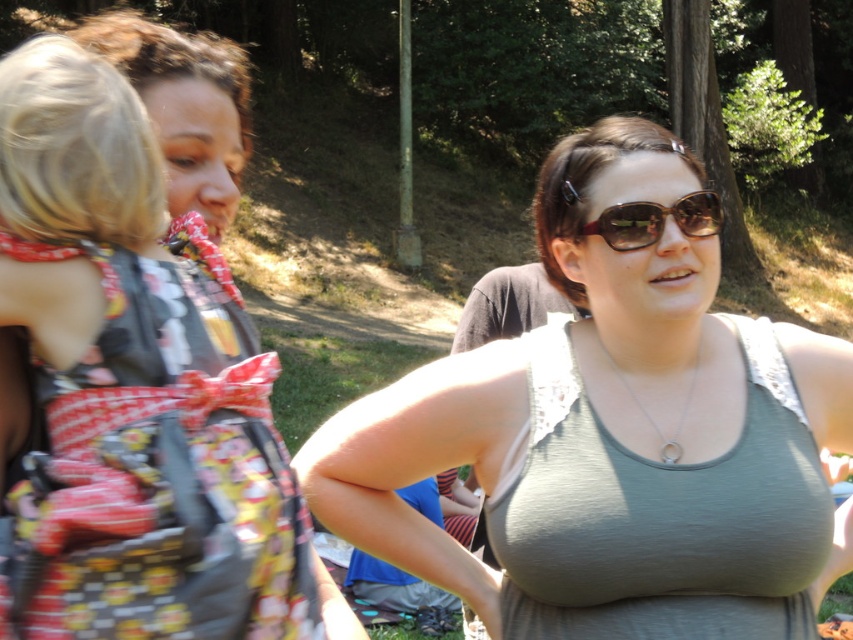
Is the position of matte gray tank top at center less distant than that of matte black dress at upper left?

No, it is behind matte black dress at upper left.

Who is lower down, matte gray tank top at center or matte black dress at upper left?

matte black dress at upper left is lower down.

This screenshot has width=853, height=640. I want to click on matte gray tank top at center, so point(596,426).

Image resolution: width=853 pixels, height=640 pixels. What do you see at coordinates (132, 392) in the screenshot? I see `matte black dress at upper left` at bounding box center [132, 392].

Which is in front, point (244, 464) or point (688, 476)?

Point (244, 464) is in front.

The height and width of the screenshot is (640, 853). I want to click on matte black dress at upper left, so click(x=132, y=392).

Between sunglasses at center and silver metallic necklace at center, which one appears on the left side from the viewer's perspective?

sunglasses at center

Where is `sunglasses at center`? The height and width of the screenshot is (640, 853). sunglasses at center is located at coordinates (656, 220).